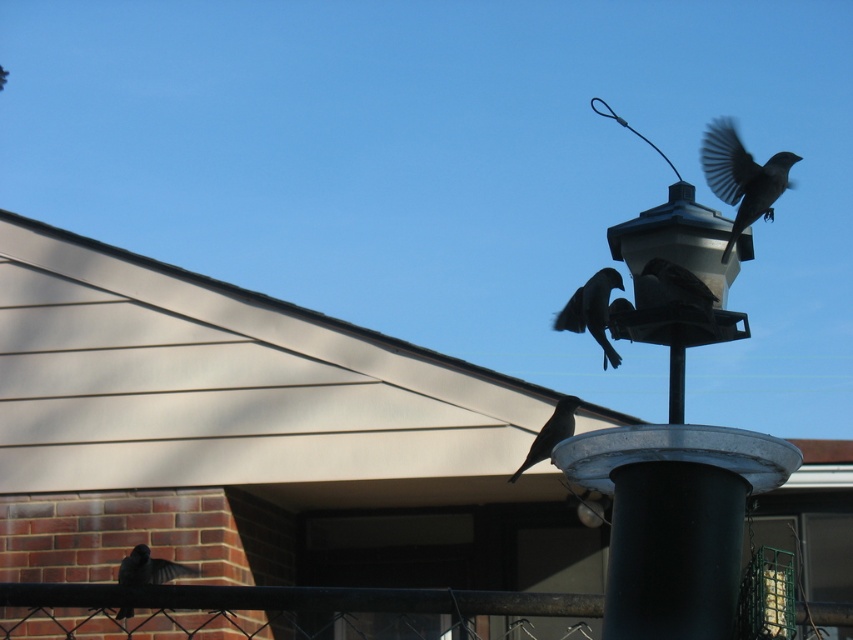
Question: Can you confirm if dark gray feathers at lower left is smaller than shiny black bird at center?

Choices:
 (A) yes
 (B) no

Answer: (A)

Question: Can you confirm if silhouette matte bird at center is wider than dark brown feathers at top right?

Choices:
 (A) yes
 (B) no

Answer: (B)

Question: Which point is farther to the camera?

Choices:
 (A) dark brown feathers at top right
 (B) dark gray feathers at lower left
 (C) silhouette matte bird at center

Answer: (B)

Question: Among these objects, which one is nearest to the camera?

Choices:
 (A) silhouette matte bird at center
 (B) dark gray feathers at lower left
 (C) shiny black bird at center
 (D) dark brown feathers at top right

Answer: (D)

Question: Which point appears closest to the camera in this image?

Choices:
 (A) (618, 358)
 (B) (672, 262)
 (C) (708, 152)

Answer: (B)

Question: Can you confirm if dark gray feathers at upper right is positioned to the right of dark gray feathers at lower left?

Choices:
 (A) yes
 (B) no

Answer: (A)